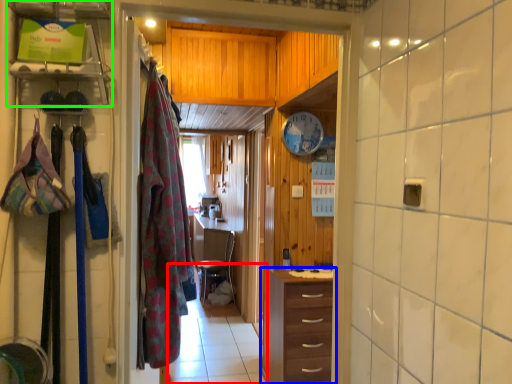
Question: Estimate the real-world distances between objects in this image. Which object is farther from path (highlighted by a red box), chest of drawers (highlighted by a blue box) or shelf (highlighted by a green box)?

Choices:
 (A) chest of drawers
 (B) shelf

Answer: (B)